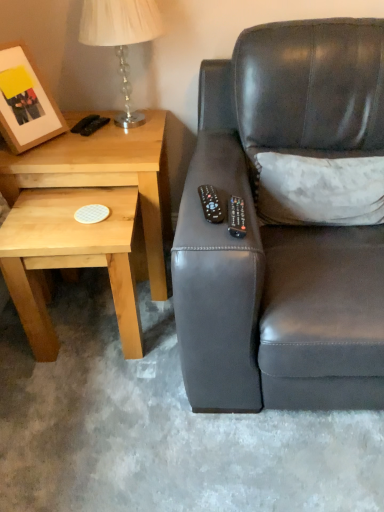
Question: Does black plastic remote at center, positioned as the 1th remote in left-to-right order, appear on the left side of matte black couch at right?

Choices:
 (A) yes
 (B) no

Answer: (A)

Question: Is matte black couch at right inside black plastic remote at center, the second remote from the right?

Choices:
 (A) no
 (B) yes

Answer: (A)

Question: From the image's perspective, does black plastic remote at center, positioned as the 1th remote in left-to-right order, appear higher than matte black couch at right?

Choices:
 (A) yes
 (B) no

Answer: (B)

Question: Is the surface of black plastic remote at center, the second remote from the right, in direct contact with matte black couch at right?

Choices:
 (A) yes
 (B) no

Answer: (B)

Question: Does black plastic remote at center, the second remote from the right, have a greater width compared to matte black couch at right?

Choices:
 (A) yes
 (B) no

Answer: (B)

Question: From the image's perspective, is matte black couch at right above or below translucent glass table lamp at upper left?

Choices:
 (A) above
 (B) below

Answer: (B)

Question: Considering the positions of matte black couch at right and translucent glass table lamp at upper left in the image, is matte black couch at right taller or shorter than translucent glass table lamp at upper left?

Choices:
 (A) short
 (B) tall

Answer: (B)

Question: Considering the relative positions of matte black couch at right and translucent glass table lamp at upper left in the image provided, is matte black couch at right to the left or to the right of translucent glass table lamp at upper left?

Choices:
 (A) right
 (B) left

Answer: (A)

Question: In terms of size, does matte black couch at right appear bigger or smaller than translucent glass table lamp at upper left?

Choices:
 (A) small
 (B) big

Answer: (B)

Question: Is wooden matte picture frame at upper left bigger or smaller than black plastic remote at center, positioned as the 1th remote in left-to-right order?

Choices:
 (A) small
 (B) big

Answer: (B)

Question: Considering the positions of wooden matte picture frame at upper left and black plastic remote at center, the second remote from the right, in the image, is wooden matte picture frame at upper left wider or thinner than black plastic remote at center, the second remote from the right,?

Choices:
 (A) thin
 (B) wide

Answer: (A)

Question: From the image's perspective, is wooden matte picture frame at upper left located above or below black plastic remote at center, the second remote from the right?

Choices:
 (A) below
 (B) above

Answer: (B)

Question: Considering the relative positions of wooden matte picture frame at upper left and black plastic remote at center, positioned as the 1th remote in left-to-right order, in the image provided, is wooden matte picture frame at upper left to the left or to the right of black plastic remote at center, positioned as the 1th remote in left-to-right order,?

Choices:
 (A) left
 (B) right

Answer: (A)

Question: Looking at their shapes, would you say light wood/textureobject at left is wider or thinner than black plastic remote at upper right, marked as the 1th remote in a right-to-left arrangement?

Choices:
 (A) thin
 (B) wide

Answer: (B)

Question: Considering the positions of point (120, 175) and point (241, 221), is point (120, 175) closer or farther from the camera than point (241, 221)?

Choices:
 (A) closer
 (B) farther

Answer: (B)